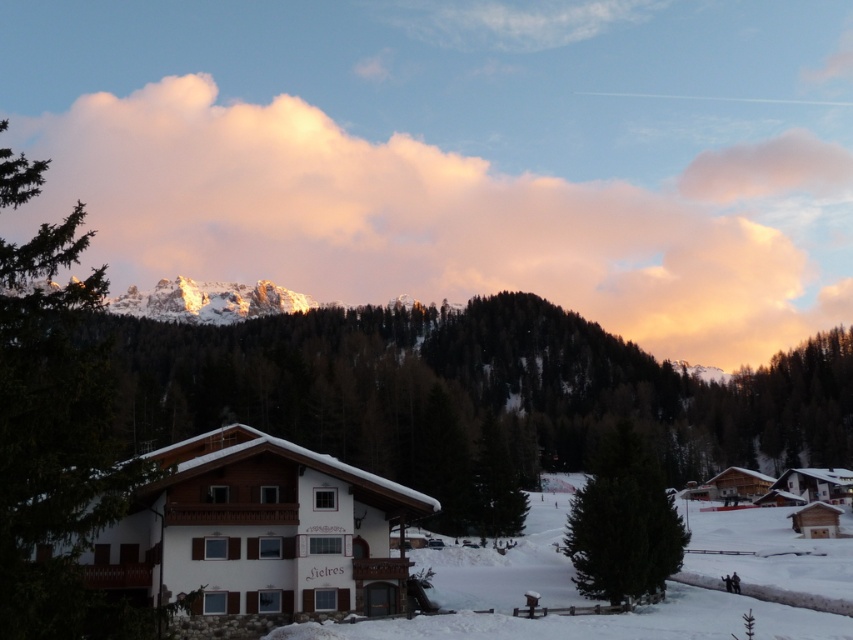
Question: Based on their relative distances, which object is nearer to the white snow ski slope at lower center?

Choices:
 (A) white fluffy cloud at upper center
 (B) snowy rock formation at upper center
 (C) pink fluffy cloud at upper center
 (D) white wooden house at center

Answer: (D)

Question: Is white snow ski slope at lower center further to the viewer compared to snowy rock formation at upper center?

Choices:
 (A) yes
 (B) no

Answer: (B)

Question: Which is farther from the white snow ski slope at lower center?

Choices:
 (A) white fluffy cloud at upper center
 (B) pink fluffy cloud at upper center
 (C) snowy rock formation at upper center
 (D) white wooden house at center

Answer: (B)

Question: Is white snow ski slope at lower center behind snowy rock formation at upper center?

Choices:
 (A) yes
 (B) no

Answer: (B)

Question: Does pink fluffy cloud at upper center appear on the right side of snowy rock formation at upper center?

Choices:
 (A) no
 (B) yes

Answer: (B)

Question: Estimate the real-world distances between objects in this image. Which object is closer to the snowy rock formation at upper center?

Choices:
 (A) green matte tree at center
 (B) white wooden house at center

Answer: (A)